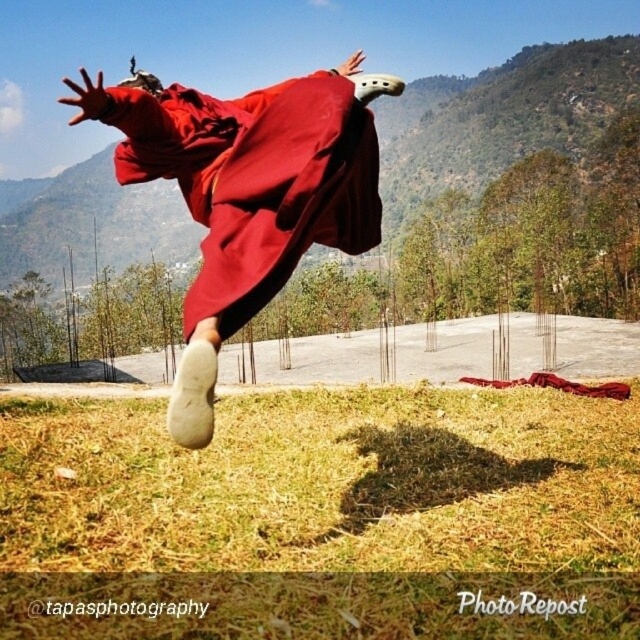
Is dry grass at lower center smaller than matte red robe at center?

Yes, dry grass at lower center is smaller than matte red robe at center.

Is point (557, 410) more distant than point (317, 100)?

Yes, it is behind point (317, 100).

This screenshot has width=640, height=640. In order to click on dry grass at lower center in this screenshot , I will do `click(324, 483)`.